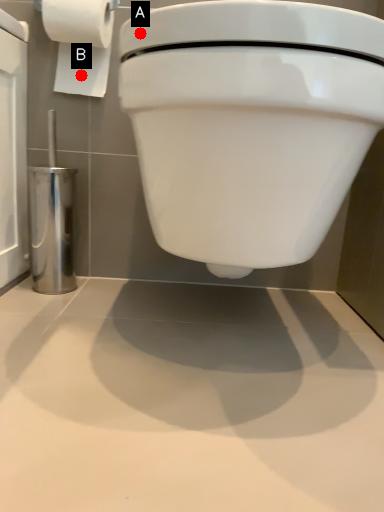
Question: Two points are circled on the image, labeled by A and B beside each circle. Among these points, which one is farthest from the camera?

Choices:
 (A) A is further
 (B) B is further

Answer: (B)